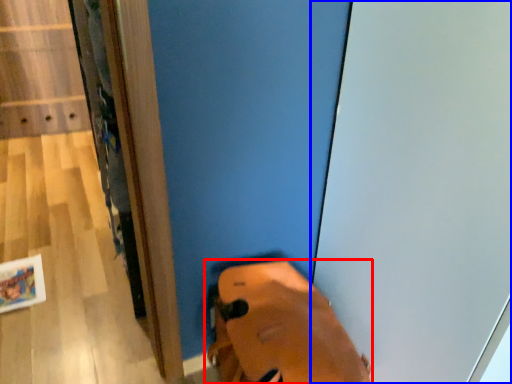
Question: Which of the following is the farthest to the observer, footwear (highlighted by a red box) or screen door (highlighted by a blue box)?

Choices:
 (A) footwear
 (B) screen door

Answer: (A)